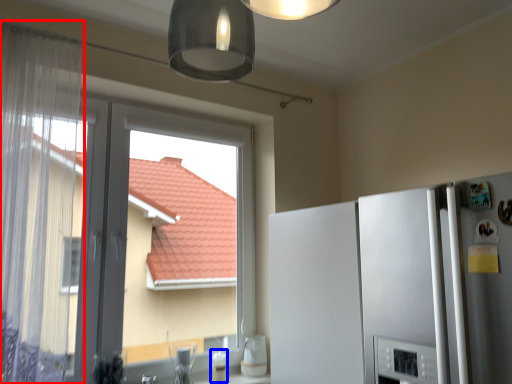
Question: Which of the following is the farthest to the observer, curtain (highlighted by a red box) or appliance (highlighted by a blue box)?

Choices:
 (A) curtain
 (B) appliance

Answer: (B)